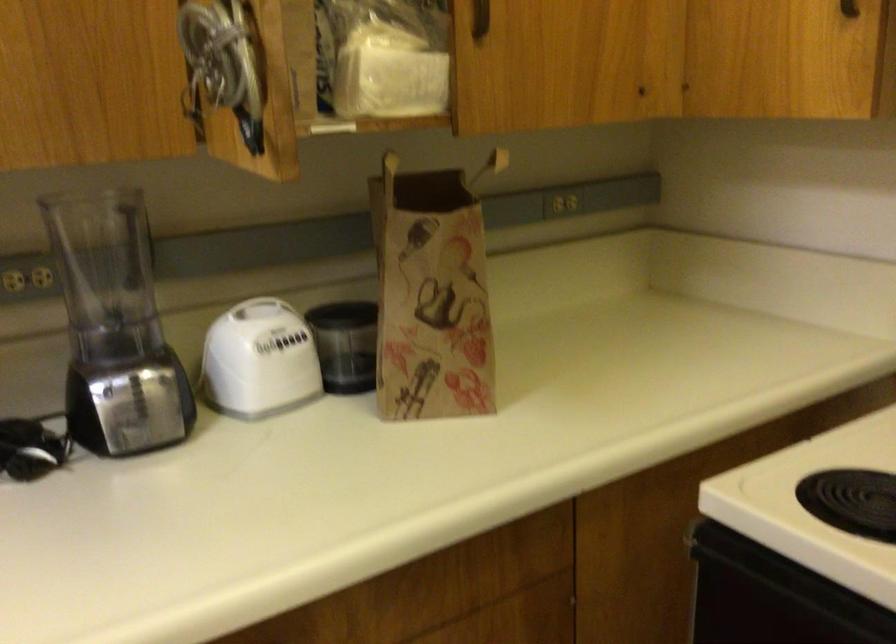
Where is `plastic tissue package`? plastic tissue package is located at coordinates (431, 295).